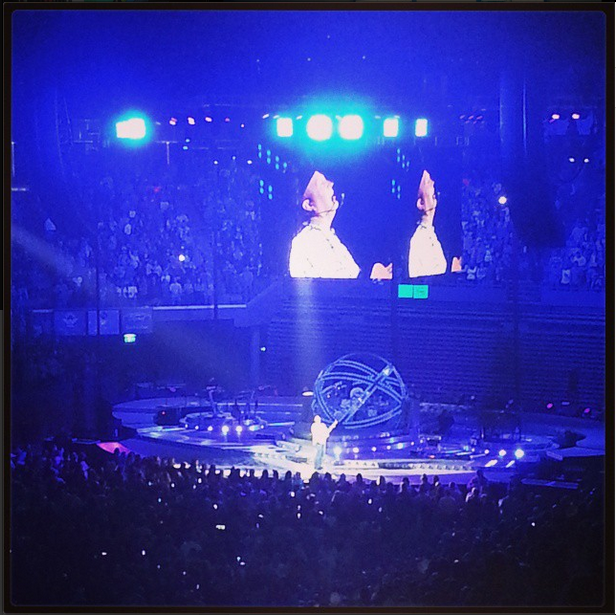
The width and height of the screenshot is (616, 615). Identify the location of mic. (424, 210).